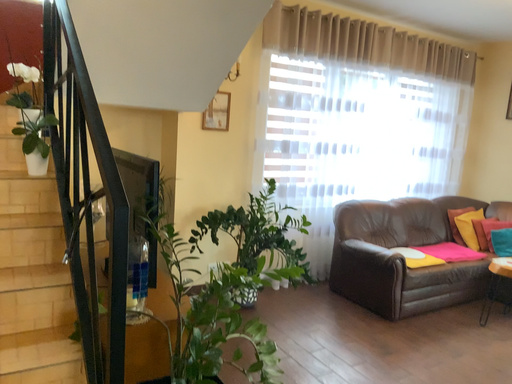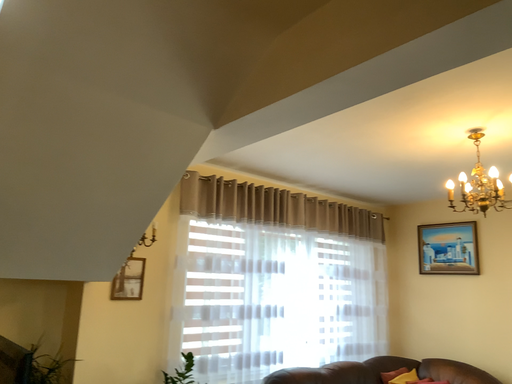
Question: How did the camera likely rotate when shooting the video?

Choices:
 (A) rotated left
 (B) rotated right

Answer: (B)